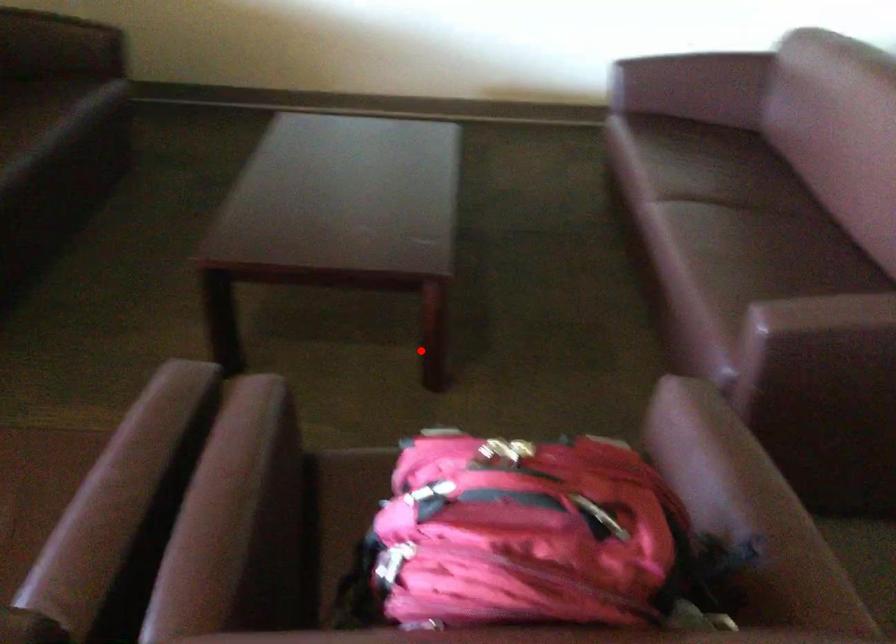
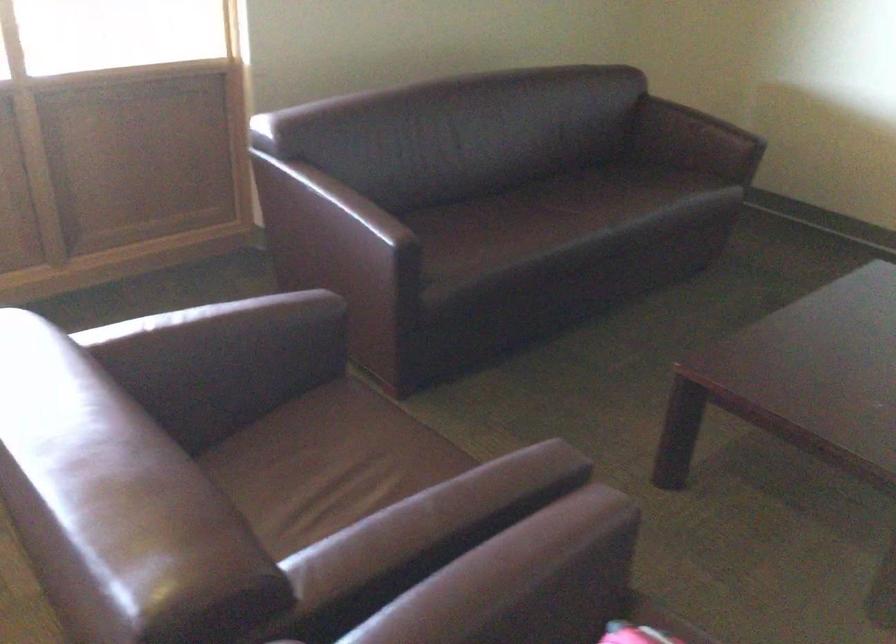
Question: I am providing you with two images of the same scene from different viewpoints. A red point is shown in image1. For the corresponding object point in image2, is it positioned nearer or farther from the camera?

Choices:
 (A) Nearer
 (B) Farther

Answer: (A)